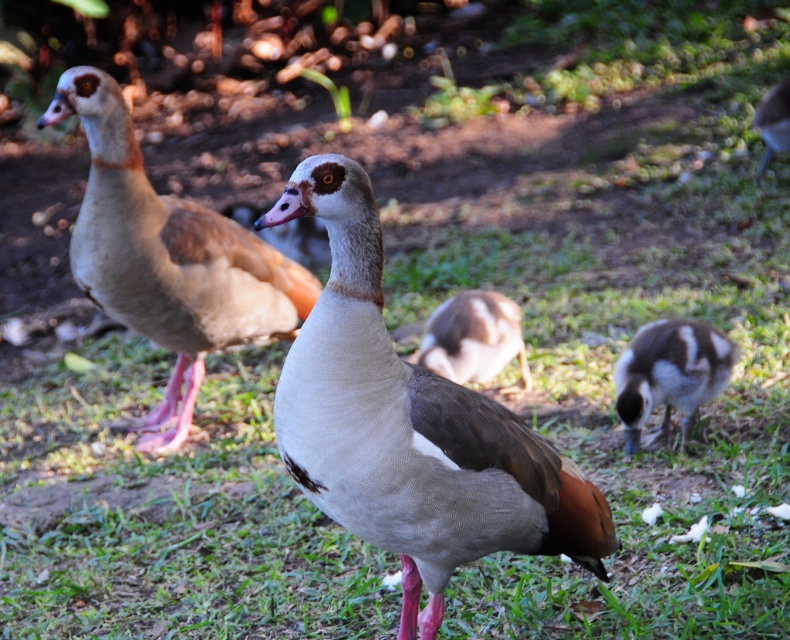
You are a birdwatcher observing the matte brown duck at center and the brown feathered duckling at center. Which one has a greater height?

The matte brown duck at center is much taller than the brown feathered duckling at center according to the description.